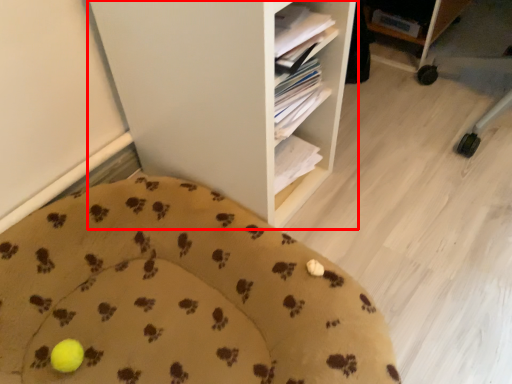
Question: Considering the relative positions of shelf (annotated by the red box) and furniture in the image provided, where is shelf (annotated by the red box) located with respect to the staircase?

Choices:
 (A) left
 (B) right

Answer: (B)